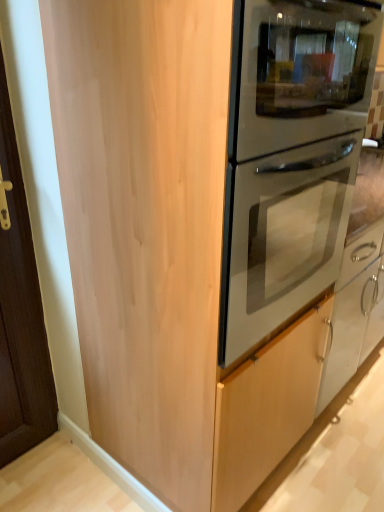
This screenshot has width=384, height=512. In order to click on matte silver oven at center in this screenshot , I will do `click(290, 156)`.

This screenshot has height=512, width=384. What do you see at coordinates (290, 156) in the screenshot?
I see `matte silver oven at center` at bounding box center [290, 156].

What is the approximate width of silver metallic door handle at lower right?

silver metallic door handle at lower right is 3.44 inches wide.

The width and height of the screenshot is (384, 512). I want to click on silver metallic door handle at lower right, so click(372, 294).

The width and height of the screenshot is (384, 512). Describe the element at coordinates (372, 294) in the screenshot. I see `silver metallic door handle at lower right` at that location.

At what (x,y) coordinates should I click in order to perform the action: click on matte silver oven at center. Please return your answer as a coordinate pair (x, y). Looking at the image, I should click on (290, 156).

Is matte silver oven at center to the left or to the right of silver metallic door handle at lower right in the image?

Based on their positions, matte silver oven at center is located to the left of silver metallic door handle at lower right.

Is matte silver oven at center closer to the viewer compared to silver metallic door handle at lower right?

Yes, the depth of matte silver oven at center is less than that of silver metallic door handle at lower right.

Is point (268, 325) in front of point (371, 278)?

That is True.

From the image's perspective, is matte silver oven at center beneath silver metallic door handle at lower right?

No, from the image's perspective, matte silver oven at center is not beneath silver metallic door handle at lower right.

From a real-world perspective, who is located higher, matte silver oven at center or silver metallic door handle at lower right?

matte silver oven at center.

From the picture: Considering the sizes of objects matte silver oven at center and silver metallic door handle at lower right in the image provided, who is thinner, matte silver oven at center or silver metallic door handle at lower right?

With smaller width is silver metallic door handle at lower right.

Considering the relative sizes of matte silver oven at center and silver metallic door handle at lower right in the image provided, is matte silver oven at center shorter than silver metallic door handle at lower right?

Incorrect, the height of matte silver oven at center does not fall short of that of silver metallic door handle at lower right.

Which of these two, matte silver oven at center or silver metallic door handle at lower right, is bigger?

With larger size is matte silver oven at center.

Based on the photo, can silver metallic door handle at lower right be found inside matte silver oven at center?

Actually, silver metallic door handle at lower right is outside matte silver oven at center.

Is matte silver oven at center touching silver metallic door handle at lower right?

No.

Is matte silver oven at center oriented away from silver metallic door handle at lower right?

→ matte silver oven at center does not have its back to silver metallic door handle at lower right.

Where is `oven above the silver metallic door handle at lower right (from a real-world perspective)`? oven above the silver metallic door handle at lower right (from a real-world perspective) is located at coordinates (290, 156).

Is silver metallic door handle at lower right to the left of matte silver oven at center from the viewer's perspective?

No, silver metallic door handle at lower right is not to the left of matte silver oven at center.

Between silver metallic door handle at lower right and matte silver oven at center, which one is positioned in front?

matte silver oven at center is in front.

Does point (376, 298) lie in front of point (309, 291)?

No, (376, 298) is further to viewer.

From the image's perspective, between silver metallic door handle at lower right and matte silver oven at center, which one is located above?

matte silver oven at center is shown above in the image.

From a real-world perspective, between silver metallic door handle at lower right and matte silver oven at center, who is vertically higher?

From a 3D spatial view, matte silver oven at center is above.

Which of these two, silver metallic door handle at lower right or matte silver oven at center, is thinner?

Thinner between the two is silver metallic door handle at lower right.

From their relative heights in the image, would you say silver metallic door handle at lower right is taller or shorter than matte silver oven at center?

Clearly, silver metallic door handle at lower right is shorter compared to matte silver oven at center.

Who is smaller, silver metallic door handle at lower right or matte silver oven at center?

silver metallic door handle at lower right is smaller.

Do you think silver metallic door handle at lower right is within matte silver oven at center, or outside of it?

silver metallic door handle at lower right is located beyond the bounds of matte silver oven at center.

Is silver metallic door handle at lower right directly adjacent to matte silver oven at center?

No, silver metallic door handle at lower right is not touching matte silver oven at center.

Is silver metallic door handle at lower right looking in the opposite direction of matte silver oven at center?

silver metallic door handle at lower right does not have its back to matte silver oven at center.

Measure the distance from silver metallic door handle at lower right to matte silver oven at center.

silver metallic door handle at lower right is 25.79 inches from matte silver oven at center.

At what (x,y) coordinates should I click in order to perform the action: click on oven on the left of silver metallic door handle at lower right. Please return your answer as a coordinate pair (x, y). Looking at the image, I should click on (290, 156).

Locate an element on the screen. The width and height of the screenshot is (384, 512). door handle on the right of matte silver oven at center is located at coordinates (372, 294).

In order to click on oven above the silver metallic door handle at lower right (from the image's perspective) in this screenshot , I will do `click(290, 156)`.